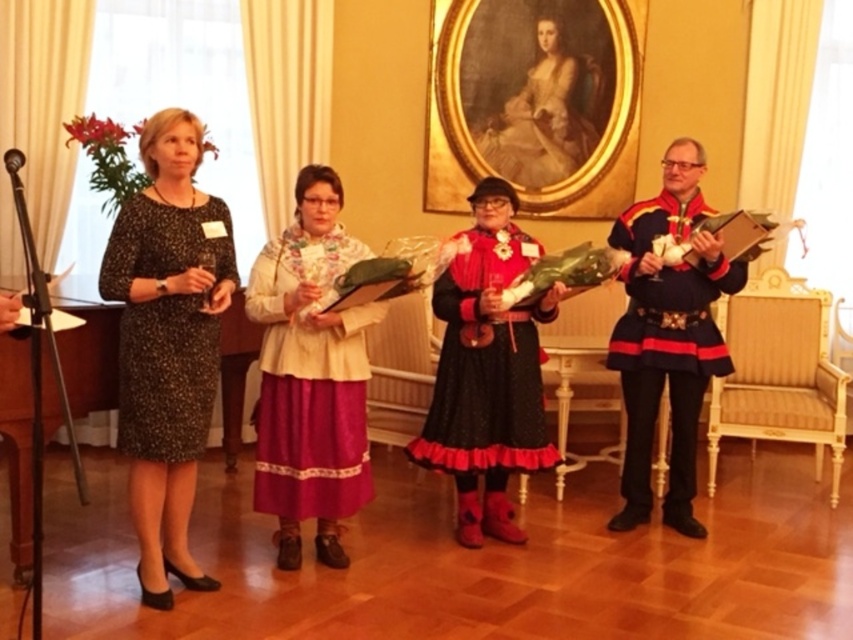
Question: Which point is closer to the camera taking this photo?

Choices:
 (A) (206, 266)
 (B) (555, 156)

Answer: (A)

Question: Estimate the real-world distances between objects in this image. Which object is closer to the matte gold dress at center?

Choices:
 (A) black velvet dress at center
 (B) black dotted dress at left
 (C) silky pink skirt at center

Answer: (A)

Question: Which of the following is the farthest from the observer?

Choices:
 (A) matte gold dress at center
 (B) black velvet dress at center

Answer: (A)

Question: From the image, what is the correct spatial relationship of silky pink skirt at center in relation to black velvet dress at center?

Choices:
 (A) below
 (B) above

Answer: (A)

Question: Does velvet black coat at right appear under black velvet dress at center?

Choices:
 (A) no
 (B) yes

Answer: (A)

Question: Does black dotted dress at left appear under matte gold dress at center?

Choices:
 (A) no
 (B) yes

Answer: (B)